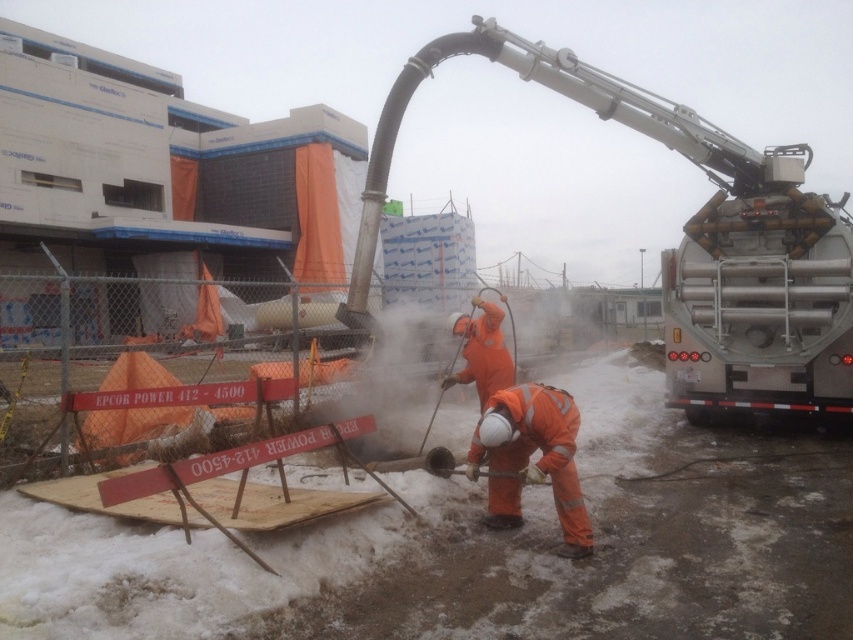
Question: Which point is closer to the camera taking this photo?

Choices:
 (A) (509, 401)
 (B) (698, 305)

Answer: (A)

Question: Does silver metallic truck at right have a smaller size compared to orange reflective workwear at lower center?

Choices:
 (A) no
 (B) yes

Answer: (A)

Question: Which point is farther to the camera?

Choices:
 (A) (762, 307)
 (B) (521, 432)

Answer: (A)

Question: Does silver metallic truck at right have a lesser width compared to orange reflective workwear at lower center?

Choices:
 (A) no
 (B) yes

Answer: (A)

Question: Is silver metallic truck at right in front of orange reflective workwear at lower center?

Choices:
 (A) yes
 (B) no

Answer: (B)